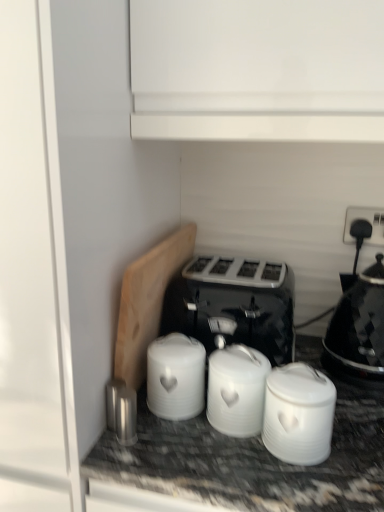
What do you see at coordinates (358, 328) in the screenshot?
I see `black glossy kettle at right` at bounding box center [358, 328].

Where is `black plastic toaster at center`? This screenshot has width=384, height=512. black plastic toaster at center is located at coordinates (234, 305).

This screenshot has height=512, width=384. In order to click on white matte jar at center, positioned as the first appliance in right-to-left order in this screenshot , I will do 298,414.

This screenshot has height=512, width=384. I want to click on black glossy kettle at right, so click(x=358, y=328).

Between point (204, 310) and point (109, 405), which one is positioned in front?

Positioned in front is point (109, 405).

Can you confirm if black plastic toaster at center is shorter than shiny metallic canister at lower center, placed as the 4th appliance when sorted from right to left?

No, black plastic toaster at center is not shorter than shiny metallic canister at lower center, placed as the 4th appliance when sorted from right to left.

Which object is further away from the camera, black plastic toaster at center or shiny metallic canister at lower center, placed as the 4th appliance when sorted from right to left?

black plastic toaster at center is further from the camera.

Locate an element on the screen. toaster that appears behind the shiny metallic canister at lower center, placed as the 4th appliance when sorted from right to left is located at coordinates (234, 305).

Which is behind, black plastic toaster at center or white matte jar at center, positioned as the first appliance in right-to-left order?

black plastic toaster at center is behind.

From the image's perspective, would you say black plastic toaster at center is positioned over white matte jar at center, the 4th appliance when ordered from left to right?

Correct, black plastic toaster at center appears higher than white matte jar at center, the 4th appliance when ordered from left to right, in the image.

Is black plastic toaster at center directly adjacent to white matte jar at center, positioned as the first appliance in right-to-left order?

No, black plastic toaster at center is not making contact with white matte jar at center, positioned as the first appliance in right-to-left order.

Is point (268, 314) positioned in front of point (322, 377)?

No, (268, 314) is further to viewer.

From a real-world perspective, which object rests below the other?

shiny metallic canister at lower center, placed as the 4th appliance when sorted from right to left.

Is shiny metallic canister at lower center, placed as the 4th appliance when sorted from right to left, at the back of white matte canisters at center, which is the third appliance in left-to-right order?

No, white matte canisters at center, which is the third appliance in left-to-right order,'s orientation is not away from shiny metallic canister at lower center, placed as the 4th appliance when sorted from right to left.

Which object is positioned more to the left, white matte canisters at center, which is the third appliance in left-to-right order, or shiny metallic canister at lower center, placed as the 4th appliance when sorted from right to left?

From the viewer's perspective, shiny metallic canister at lower center, placed as the 4th appliance when sorted from right to left, appears more on the left side.

Is white ceramic canister at center, the 3th appliance in the right-to-left sequence, far from black glossy kettle at right?

They are positioned close to each other.

Which object is closer to the camera, white ceramic canister at center, arranged as the 2th appliance when viewed from the left, or black glossy kettle at right?

white ceramic canister at center, arranged as the 2th appliance when viewed from the left, is closer to the camera.

Which is in front, point (168, 391) or point (366, 284)?

Point (168, 391)

Would you say black glossy kettle at right is part of white ceramic canister at center, the 3th appliance in the right-to-left sequence,'s contents?

That's incorrect, black glossy kettle at right is not inside white ceramic canister at center, the 3th appliance in the right-to-left sequence.

From a real-world perspective, which object stands above the other?

white matte canisters at center, which is the third appliance in left-to-right order.

Is shiny metallic canister at lower center, placed as the 4th appliance when sorted from right to left, touching white matte canisters at center, the second appliance positioned from the right?

No.

Would you say shiny metallic canister at lower center, positioned as the 1th appliance in left-to-right order, contains white matte canisters at center, the second appliance positioned from the right?

No, shiny metallic canister at lower center, positioned as the 1th appliance in left-to-right order, does not contain white matte canisters at center, the second appliance positioned from the right.

In the scene shown: From the image's perspective, is white matte canisters at center, which is the third appliance in left-to-right order, located beneath black plastic toaster at center?

Yes, from the image's perspective, white matte canisters at center, which is the third appliance in left-to-right order, is beneath black plastic toaster at center.

Considering the sizes of objects white matte canisters at center, the second appliance positioned from the right, and black plastic toaster at center in the image provided, who is wider, white matte canisters at center, the second appliance positioned from the right, or black plastic toaster at center?

Wider between the two is black plastic toaster at center.

Is white matte canisters at center, the second appliance positioned from the right, in front of or behind black plastic toaster at center in the image?

In the image, white matte canisters at center, the second appliance positioned from the right, appears in front of black plastic toaster at center.

There is a black plastic toaster at center. Where is `the 2nd appliance below it (from the image's perspective)`? This screenshot has width=384, height=512. the 2nd appliance below it (from the image's perspective) is located at coordinates (237, 390).

Is point (365, 293) positioned after point (117, 402)?

Yes, point (365, 293) is behind point (117, 402).

Considering the positions of objects black glossy kettle at right and shiny metallic canister at lower center, positioned as the 1th appliance in left-to-right order, in the image provided, who is behind, black glossy kettle at right or shiny metallic canister at lower center, positioned as the 1th appliance in left-to-right order,?

black glossy kettle at right is behind.

Considering the relative positions of black glossy kettle at right and shiny metallic canister at lower center, positioned as the 1th appliance in left-to-right order, in the image provided, is black glossy kettle at right to the left or to the right of shiny metallic canister at lower center, positioned as the 1th appliance in left-to-right order,?

Based on their positions, black glossy kettle at right is located to the right of shiny metallic canister at lower center, positioned as the 1th appliance in left-to-right order.

The height and width of the screenshot is (512, 384). I want to click on toaster that appears on the right of shiny metallic canister at lower center, placed as the 4th appliance when sorted from right to left, so click(234, 305).

This screenshot has width=384, height=512. Identify the location of the 4th appliance in front of the black plastic toaster at center, counting from the anchor's position. pyautogui.click(x=298, y=414).

From the image, which object appears to be nearer to white matte canisters at center, the second appliance positioned from the right, black glossy kettle at right or black plastic socket at upper right?

black glossy kettle at right lies closer to white matte canisters at center, the second appliance positioned from the right, than the other object.

Which object lies further to the anchor point black plastic toaster at center, white ceramic canister at center, the 3th appliance in the right-to-left sequence, or shiny metallic canister at lower center, positioned as the 1th appliance in left-to-right order?

The object further to black plastic toaster at center is shiny metallic canister at lower center, positioned as the 1th appliance in left-to-right order.

Based on their spatial positions, is black plastic socket at upper right or white ceramic canister at center, arranged as the 2th appliance when viewed from the left, closer to white matte canisters at center, the second appliance positioned from the right?

white ceramic canister at center, arranged as the 2th appliance when viewed from the left.

Considering their positions, is black plastic socket at upper right positioned further to white matte canisters at center, which is the third appliance in left-to-right order, than shiny metallic canister at lower center, positioned as the 1th appliance in left-to-right order?

black plastic socket at upper right.

Looking at the image, which one is located closer to black glossy kettle at right, white matte jar at center, the 4th appliance when ordered from left to right, or black plastic socket at upper right?

black plastic socket at upper right lies closer to black glossy kettle at right than the other object.

When comparing their distances from shiny metallic canister at lower center, positioned as the 1th appliance in left-to-right order, does white ceramic canister at center, the 3th appliance in the right-to-left sequence, or black plastic socket at upper right seem closer?

white ceramic canister at center, the 3th appliance in the right-to-left sequence, is positioned closer to the anchor shiny metallic canister at lower center, positioned as the 1th appliance in left-to-right order.

Looking at the image, which one is located further to black plastic socket at upper right, white ceramic canister at center, the 3th appliance in the right-to-left sequence, or white matte jar at center, positioned as the first appliance in right-to-left order?

Among the two, white ceramic canister at center, the 3th appliance in the right-to-left sequence, is located further to black plastic socket at upper right.

Looking at the image, which one is located closer to shiny metallic canister at lower center, placed as the 4th appliance when sorted from right to left, black plastic toaster at center or black glossy kettle at right?

Among the two, black plastic toaster at center is located nearer to shiny metallic canister at lower center, placed as the 4th appliance when sorted from right to left.

The image size is (384, 512). In order to click on appliance between white ceramic canister at center, the 3th appliance in the right-to-left sequence, and white matte jar at center, the 4th appliance when ordered from left to right, from left to right in this screenshot , I will do `click(237, 390)`.

Identify the location of appliance between black plastic toaster at center and black plastic socket at upper right. (298, 414).

Locate an element on the screen. The height and width of the screenshot is (512, 384). toaster between white ceramic canister at center, arranged as the 2th appliance when viewed from the left, and black plastic socket at upper right from left to right is located at coordinates 234,305.

Find the location of `kettle between white matte jar at center, positioned as the first appliance in right-to-left order, and black plastic socket at upper right, along the z-axis`. kettle between white matte jar at center, positioned as the first appliance in right-to-left order, and black plastic socket at upper right, along the z-axis is located at coordinates (358, 328).